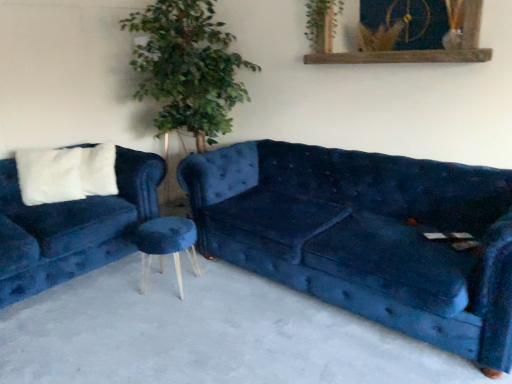
Question: Considering the relative positions of green leafy plant at upper center and velvet blue couch at left, which is the first studio couch from left to right, in the image provided, is green leafy plant at upper center to the right of velvet blue couch at left, which is the first studio couch from left to right, from the viewer's perspective?

Choices:
 (A) no
 (B) yes

Answer: (B)

Question: Considering the relative sizes of green leafy plant at upper center and velvet blue couch at left, arranged as the 2th studio couch when viewed from the right, in the image provided, is green leafy plant at upper center wider than velvet blue couch at left, arranged as the 2th studio couch when viewed from the right,?

Choices:
 (A) yes
 (B) no

Answer: (B)

Question: Considering the relative positions of green leafy plant at upper center and velvet blue couch at left, which is the first studio couch from left to right, in the image provided, is green leafy plant at upper center in front of velvet blue couch at left, which is the first studio couch from left to right,?

Choices:
 (A) no
 (B) yes

Answer: (A)

Question: Is green leafy plant at upper center located outside velvet blue couch at left, arranged as the 2th studio couch when viewed from the right?

Choices:
 (A) no
 (B) yes

Answer: (B)

Question: Does green leafy plant at upper center have a lesser height compared to velvet blue couch at left, which is the first studio couch from left to right?

Choices:
 (A) yes
 (B) no

Answer: (A)

Question: Is white fluffy pillow at left bigger or smaller than velvet blue stool at center?

Choices:
 (A) big
 (B) small

Answer: (B)

Question: In the image, is white fluffy pillow at left positioned in front of or behind velvet blue stool at center?

Choices:
 (A) front
 (B) behind

Answer: (B)

Question: From the image's perspective, relative to velvet blue stool at center, is white fluffy pillow at left above or below?

Choices:
 (A) below
 (B) above

Answer: (B)

Question: Looking at their shapes, would you say white fluffy pillow at left is wider or thinner than velvet blue stool at center?

Choices:
 (A) thin
 (B) wide

Answer: (A)

Question: Does point (126, 195) appear closer or farther from the camera than point (109, 157)?

Choices:
 (A) closer
 (B) farther

Answer: (A)

Question: Is velvet blue couch at left, arranged as the 2th studio couch when viewed from the right, to the left or to the right of white fluffy pillow at left in the image?

Choices:
 (A) left
 (B) right

Answer: (A)

Question: Relative to white fluffy pillow at left, is velvet blue couch at left, arranged as the 2th studio couch when viewed from the right, in front or behind?

Choices:
 (A) front
 (B) behind

Answer: (A)

Question: Based on their sizes in the image, would you say velvet blue couch at left, which is the first studio couch from left to right, is bigger or smaller than white fluffy pillow at left?

Choices:
 (A) small
 (B) big

Answer: (B)

Question: In terms of width, does green leafy plant at upper center look wider or thinner when compared to white fluffy pillow at left?

Choices:
 (A) wide
 (B) thin

Answer: (B)

Question: From a real-world perspective, is green leafy plant at upper center above or below white fluffy pillow at left?

Choices:
 (A) below
 (B) above

Answer: (B)